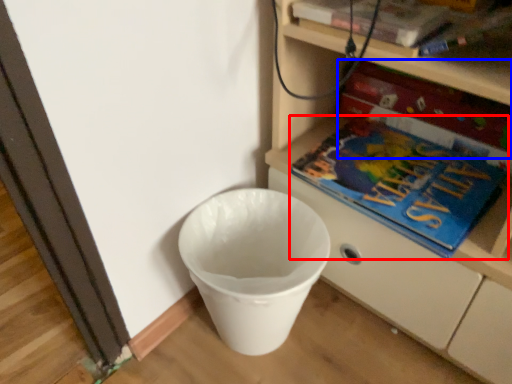
Question: Which of the following is the farthest to the observer, book (highlighted by a red box) or paperback book (highlighted by a blue box)?

Choices:
 (A) book
 (B) paperback book

Answer: (B)